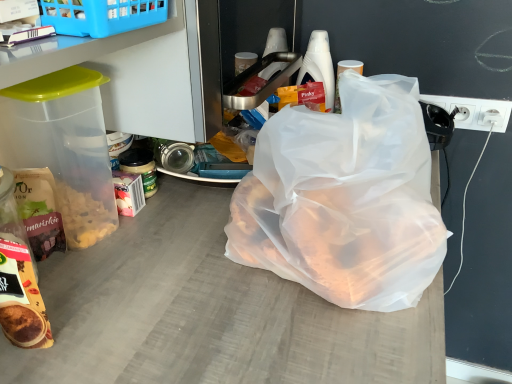
Question: Is white plastic bottle at upper right oriented towards white plastic socket at right?

Choices:
 (A) no
 (B) yes

Answer: (B)

Question: Can you confirm if white plastic bottle at upper right is shorter than white plastic socket at right?

Choices:
 (A) yes
 (B) no

Answer: (B)

Question: Does white plastic bottle at upper right come in front of white plastic socket at right?

Choices:
 (A) no
 (B) yes

Answer: (B)

Question: Considering the relative sizes of white plastic bottle at upper right and white plastic socket at right in the image provided, is white plastic bottle at upper right bigger than white plastic socket at right?

Choices:
 (A) yes
 (B) no

Answer: (A)

Question: Is white plastic socket at right a part of white plastic bottle at upper right?

Choices:
 (A) no
 (B) yes

Answer: (A)

Question: Does white plastic bottle at upper right have a lesser width compared to white plastic socket at right?

Choices:
 (A) no
 (B) yes

Answer: (A)

Question: Can you confirm if matte brown snack bag at lower left is wider than transparent plastic bag at center?

Choices:
 (A) no
 (B) yes

Answer: (A)

Question: Is matte brown snack bag at lower left positioned before transparent plastic bag at center?

Choices:
 (A) no
 (B) yes

Answer: (A)

Question: Is matte brown snack bag at lower left smaller than transparent plastic bag at center?

Choices:
 (A) no
 (B) yes

Answer: (B)

Question: Is matte brown snack bag at lower left facing away from transparent plastic bag at center?

Choices:
 (A) yes
 (B) no

Answer: (B)

Question: Can you confirm if matte brown snack bag at lower left is taller than transparent plastic bag at center?

Choices:
 (A) yes
 (B) no

Answer: (B)

Question: Considering the relative sizes of matte brown snack bag at lower left and transparent plastic bag at center in the image provided, is matte brown snack bag at lower left bigger than transparent plastic bag at center?

Choices:
 (A) yes
 (B) no

Answer: (B)

Question: Would you say matte brown snack bag at lower left contains matte brown bag of cereal at left?

Choices:
 (A) no
 (B) yes

Answer: (A)